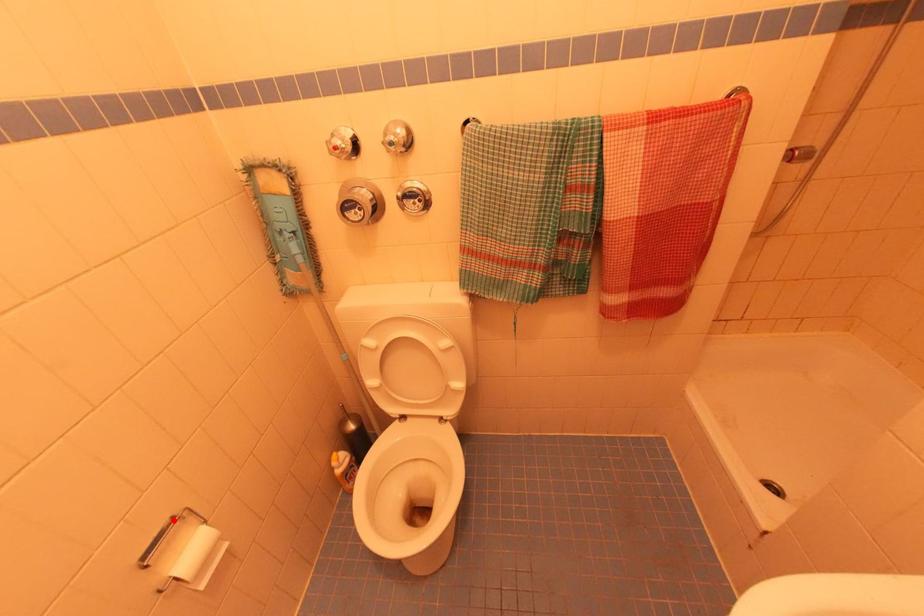
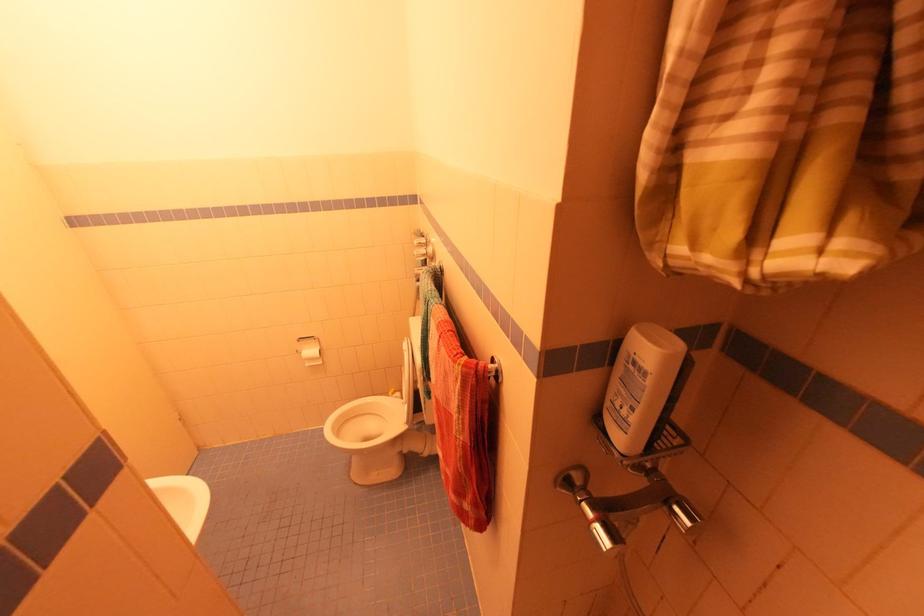
Question: I am providing you with two images of the same scene from different viewpoints. A red point is marked on the first image. Can you still see the location of the red point in image 2?

Choices:
 (A) Yes
 (B) No

Answer: (A)